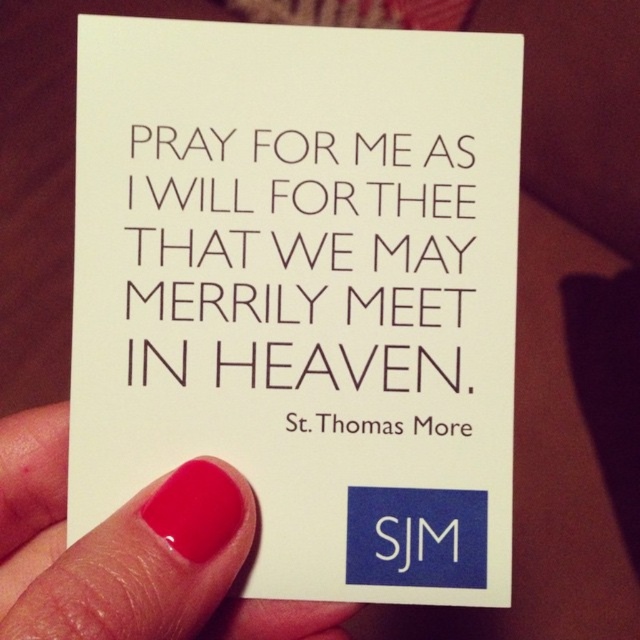
Question: Does white paper at center have a larger size compared to pink nail polish at lower left?

Choices:
 (A) yes
 (B) no

Answer: (B)

Question: Considering the real-world distances, which object is closest to the black paper text at center?

Choices:
 (A) pink nail polish at lower left
 (B) white paper at center

Answer: (B)

Question: Which point appears farthest from the camera in this image?

Choices:
 (A) (428, 563)
 (B) (141, 628)
 (C) (141, 225)

Answer: (C)

Question: Based on their relative distances, which object is farther from the pink nail polish at lower left?

Choices:
 (A) white paper at center
 (B) black paper text at center

Answer: (B)

Question: Is white paper at center positioned in front of pink nail polish at lower left?

Choices:
 (A) yes
 (B) no

Answer: (B)

Question: Is white paper at center below pink nail polish at lower left?

Choices:
 (A) no
 (B) yes

Answer: (A)